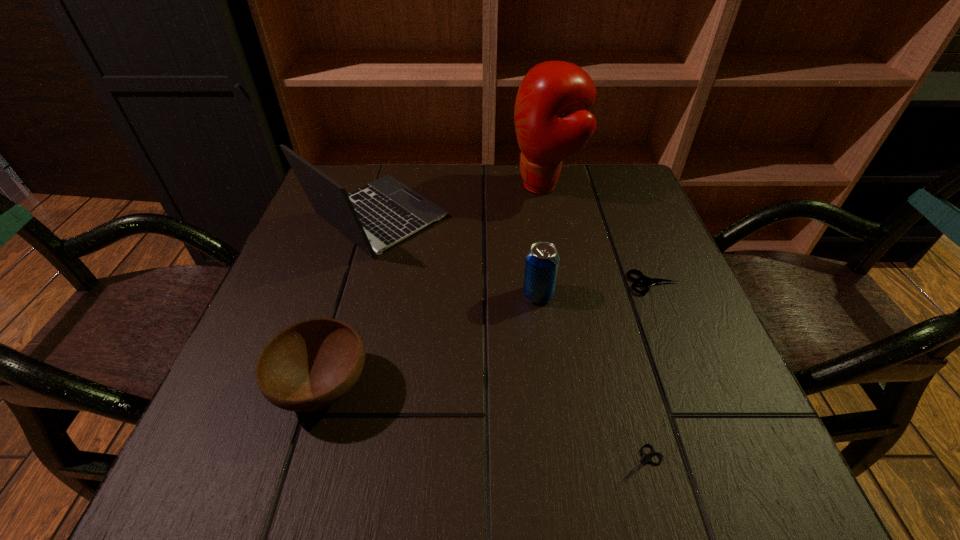
This screenshot has width=960, height=540. I want to click on boxing glove, so click(552, 120).

Image resolution: width=960 pixels, height=540 pixels. What are the coordinates of `laptop_computer` in the screenshot? It's located at (385, 211).

This screenshot has width=960, height=540. Identify the location of the third tallest object. (542, 260).

Locate an element on the screen. bowl is located at coordinates (311, 364).

Locate an element on the screen. The width and height of the screenshot is (960, 540). the fifth farthest object is located at coordinates (311, 364).

You are a GUI agent. You are given a task and a screenshot of the screen. Output one action in this format:
    pyautogui.click(x=<x>, y=<y>)
    Task: Click on the right shears
    This screenshot has width=960, height=540.
    Given the screenshot: What is the action you would take?
    pyautogui.click(x=643, y=280)

Locate an element on the screen. the fifth tallest object is located at coordinates coord(643,280).

The width and height of the screenshot is (960, 540). What are the coordinates of `the nearer shears` in the screenshot? It's located at (646, 458).

At what (x,y) coordinates should I click in order to perform the action: click on the nearest object. Please return your answer as a coordinate pair (x, y). The height and width of the screenshot is (540, 960). Looking at the image, I should click on (646, 458).

The height and width of the screenshot is (540, 960). I want to click on vacant region located on the striking surface of the tallest object, so click(x=405, y=186).